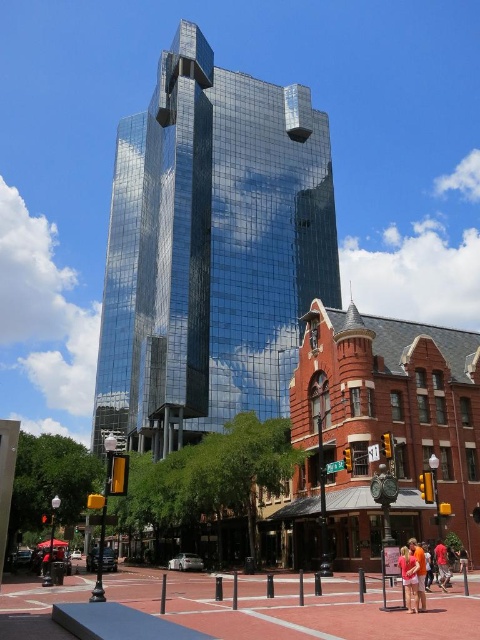
You are standing at the intersection in front of the modern skyscraper and the historic red brick building. You want to take a photo of both buildings in the same frame. If you position yourself so that the two points, point 1 at coordinates point (x=144, y=285) and point 2 at coordinates point (x=441, y=580), are aligned along your camera view, which point should be closer to the camera lens to ensure both buildings are in focus?

Point 1 at coordinates point (x=144, y=285) should be closer to the camera lens because it is behind point (x=441, y=580). By placing the closer point nearer to the lens, the depth of field will allow both buildings to be in focus.

In the scene shown: You are a photographer standing in the middle of the street. You want to take a photo that includes both the shiny glass building at center and the red cotton shirt at lower right. Which object should you adjust your camera angle to include first?

The shiny glass building at center is positioned over the red cotton shirt at lower right, so you should adjust your camera angle to include the shiny glass building at center first as it is closer to your viewpoint.